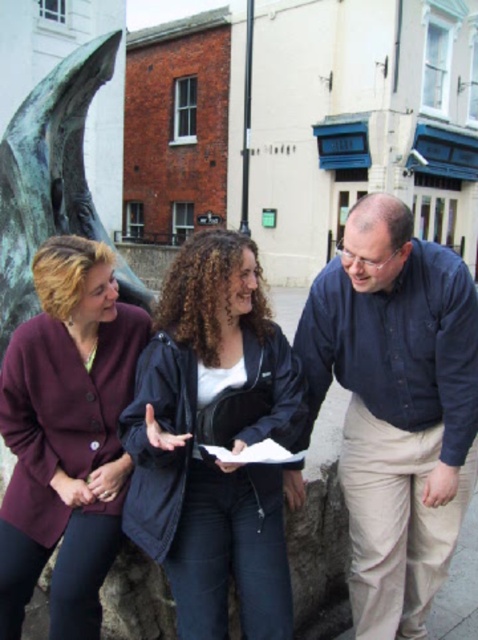
Question: Estimate the real-world distances between objects in this image. Which object is closer to the matte purple cardigan at center left?

Choices:
 (A) black matte jacket at center
 (B) blue button-down shirt at center

Answer: (A)

Question: Estimate the real-world distances between objects in this image. Which object is farther from the black matte jacket at center?

Choices:
 (A) dark blue jacket at center
 (B) matte purple cardigan at center left

Answer: (A)

Question: Which point appears closest to the camera in this image?

Choices:
 (A) (313, 524)
 (B) (162, 531)
 (C) (454, 541)
 (D) (39, 556)

Answer: (B)

Question: Does black matte jacket at center lie in front of matte purple cardigan at center left?

Choices:
 (A) no
 (B) yes

Answer: (B)

Question: Considering the relative positions of blue button-down shirt at center and dark blue jacket at center in the image provided, where is blue button-down shirt at center located with respect to dark blue jacket at center?

Choices:
 (A) left
 (B) right

Answer: (B)

Question: Can you confirm if blue button-down shirt at center is positioned to the left of black matte jacket at center?

Choices:
 (A) yes
 (B) no

Answer: (B)